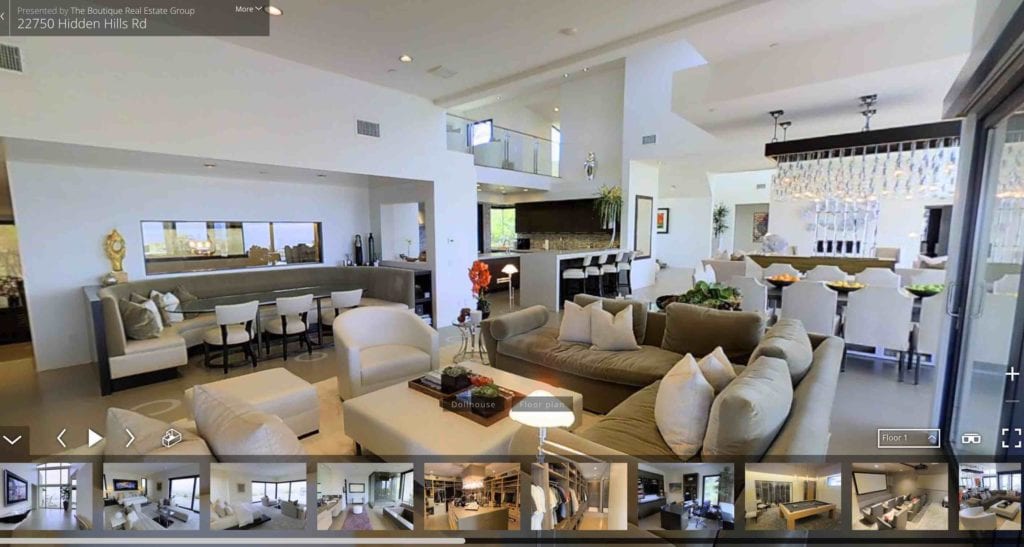
Where is `hotel lobby`? hotel lobby is located at coordinates [x=290, y=352].